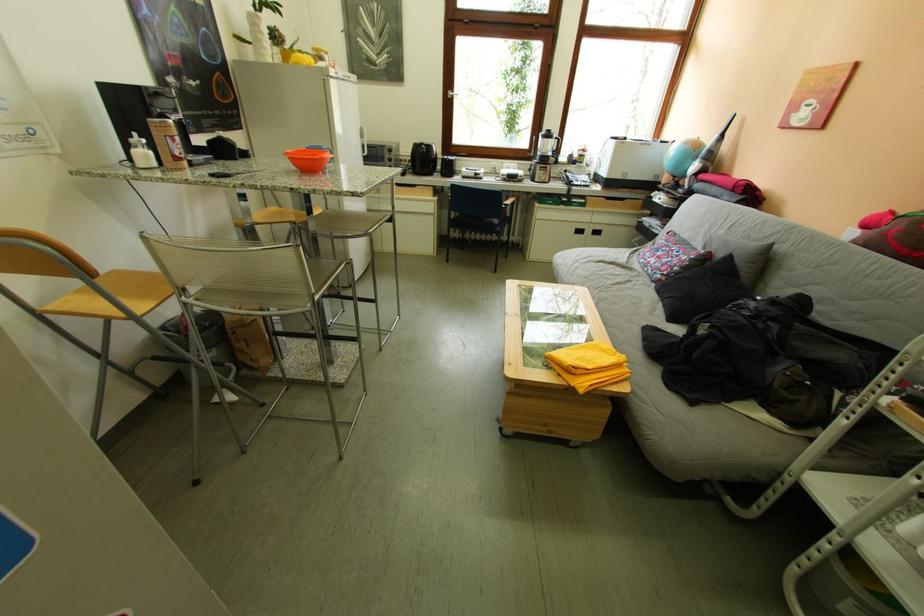
This screenshot has height=616, width=924. Describe the element at coordinates (313, 274) in the screenshot. I see `the silver chair sitting surface` at that location.